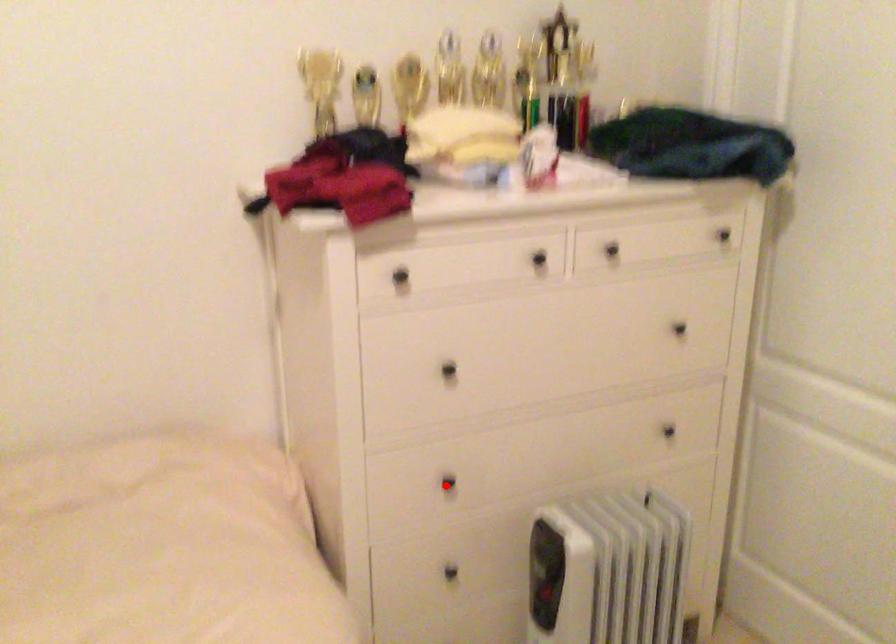
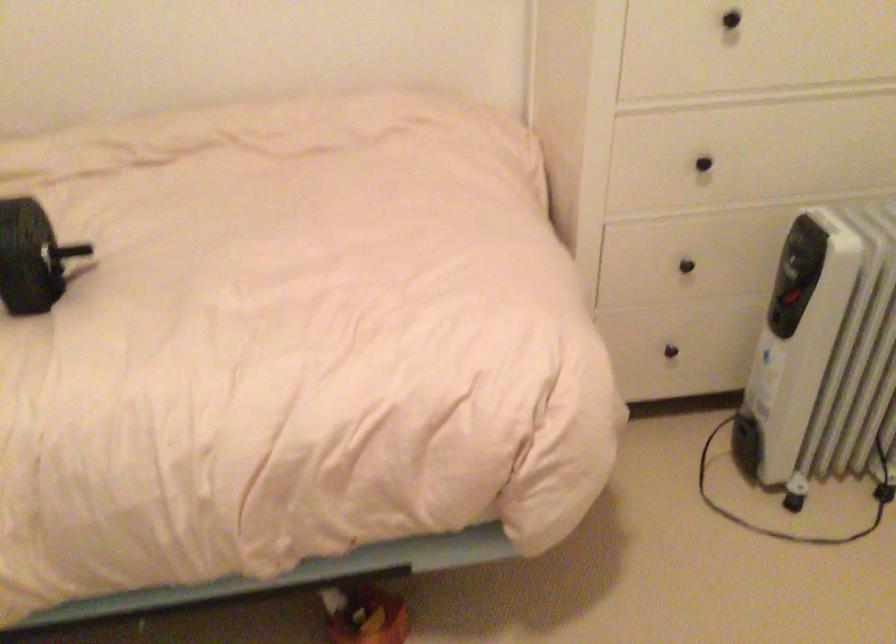
Where in the second image is the point corresponding to the highlighted location from the first image?

(702, 164)